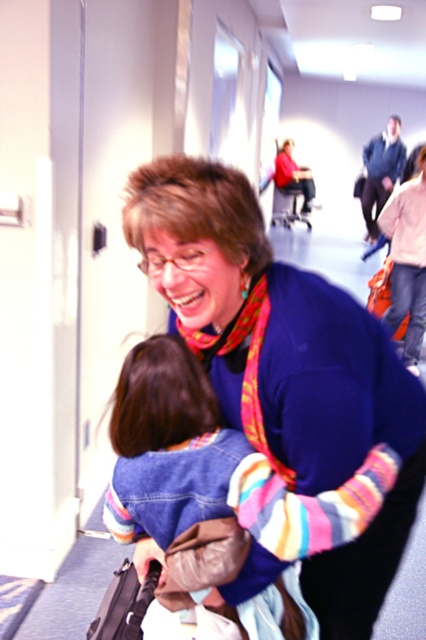
You are a fashion designer observing the scene. You need to decide which clothing item, the blue sweater at center or the denim jacket at lower right, would require more fabric to produce. Based on the description, which one would you choose?

The blue sweater at center is larger in size than the denim jacket at lower right, so it would require more fabric to produce.